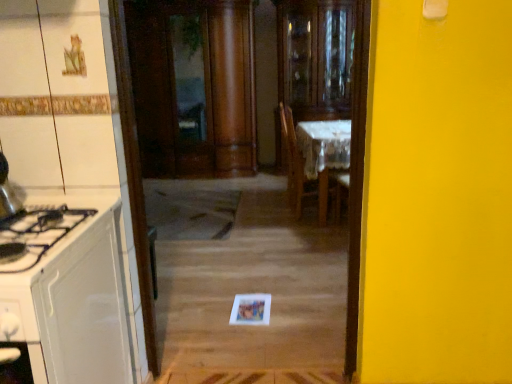
Image resolution: width=512 pixels, height=384 pixels. Describe the element at coordinates (74, 293) in the screenshot. I see `white glossy cabinet at left` at that location.

Locate an element on the screen. The image size is (512, 384). white glossy cabinet at left is located at coordinates (74, 293).

Based on the photo, is white lace tablecloth at center far from transparent glass cabinet at center?

That's right, there is a large distance between white lace tablecloth at center and transparent glass cabinet at center.

From the image's perspective, is white lace tablecloth at center on transparent glass cabinet at center?

Actually, white lace tablecloth at center appears below transparent glass cabinet at center in the image.

Does white lace tablecloth at center appear on the left side of transparent glass cabinet at center?

Yes, white lace tablecloth at center is to the left of transparent glass cabinet at center.

From the picture: Is the depth of transparent glass cabinet at center greater than that of white lace tablecloth at center?

Yes, transparent glass cabinet at center is further from the camera.

From the image's perspective, is transparent glass cabinet at center positioned above or below white lace tablecloth at center?

From the image's perspective, transparent glass cabinet at center appears above white lace tablecloth at center.

From a real-world perspective, is transparent glass cabinet at center above or below white lace tablecloth at center?

transparent glass cabinet at center is above white lace tablecloth at center.

At what (x,y) coordinates should I click in order to perform the action: click on cabinetry that appears on the left of white lace tablecloth at center. Please return your answer as a coordinate pair (x, y). Image resolution: width=512 pixels, height=384 pixels. Looking at the image, I should click on (74, 293).

From the image's perspective, would you say white lace tablecloth at center is shown under white glossy cabinet at left?

No.

Can you tell me how much white lace tablecloth at center and white glossy cabinet at left differ in facing direction?

The angle between the facing direction of white lace tablecloth at center and the facing direction of white glossy cabinet at left is 90 degrees.

Is white lace tablecloth at center completely or partially outside of white glossy cabinet at left?

Absolutely, white lace tablecloth at center is external to white glossy cabinet at left.

In terms of size, does white glossy cabinet at left appear bigger or smaller than transparent glass cabinet at center?

In the image, white glossy cabinet at left appears to be smaller than transparent glass cabinet at center.

Is point (47, 235) behind point (298, 109)?

No, (47, 235) is closer to viewer.

Does white glossy cabinet at left appear on the left side of transparent glass cabinet at center?

Yes, white glossy cabinet at left is to the left of transparent glass cabinet at center.

From the image's perspective, which is below, white glossy cabinet at left or white lace tablecloth at center?

From the image's view, white glossy cabinet at left is below.

In terms of width, does white glossy cabinet at left look wider or thinner when compared to white lace tablecloth at center?

Clearly, white glossy cabinet at left has more width compared to white lace tablecloth at center.

Which object is positioned more to the left, white glossy cabinet at left or white lace tablecloth at center?

white glossy cabinet at left is more to the left.

The image size is (512, 384). Identify the location of table that appears above the white glossy cabinet at left (from the image's perspective). (324, 153).

Is transparent glass cabinet at center taller than white glossy cabinet at left?

Yes.

Is transparent glass cabinet at center to the right of white glossy cabinet at left from the viewer's perspective?

Yes.

From the image's perspective, would you say transparent glass cabinet at center is shown under white glossy cabinet at left?

No, from the image's perspective, transparent glass cabinet at center is not beneath white glossy cabinet at left.

What's the angular difference between transparent glass cabinet at center and white glossy cabinet at left's facing directions?

transparent glass cabinet at center and white glossy cabinet at left are facing 0.000162 degrees away from each other.

At what (x,y) coordinates should I click in order to perform the action: click on glass door behind the white lace tablecloth at center. Please return your answer as a coordinate pair (x, y). The width and height of the screenshot is (512, 384). Looking at the image, I should click on (316, 57).

Where is `table that appears in front of the transparent glass cabinet at center`? This screenshot has width=512, height=384. table that appears in front of the transparent glass cabinet at center is located at coordinates (324, 153).

Considering their positions, is transparent glass cabinet at center positioned closer to white glossy cabinet at left than white lace tablecloth at center?

white lace tablecloth at center lies closer to white glossy cabinet at left than the other object.

Based on their spatial positions, is transparent glass cabinet at center or white glossy cabinet at left further from white lace tablecloth at center?

The object further to white lace tablecloth at center is white glossy cabinet at left.

Considering their positions, is white lace tablecloth at center positioned further to transparent glass cabinet at center than white glossy cabinet at left?

white glossy cabinet at left is positioned further to the anchor transparent glass cabinet at center.

Looking at the image, which one is located further to transparent glass cabinet at center, white glossy cabinet at left or white lace tablecloth at center?

white glossy cabinet at left is further to transparent glass cabinet at center.

In the scene shown: From the image, which object appears to be farther from white glossy cabinet at left, white lace tablecloth at center or transparent glass cabinet at center?

Based on the image, transparent glass cabinet at center appears to be further to white glossy cabinet at left.

Based on their spatial positions, is white glossy cabinet at left or transparent glass cabinet at center closer to white lace tablecloth at center?

Among the two, transparent glass cabinet at center is located nearer to white lace tablecloth at center.

Locate an element on the screen. The height and width of the screenshot is (384, 512). table between white glossy cabinet at left and transparent glass cabinet at center along the z-axis is located at coordinates (324, 153).